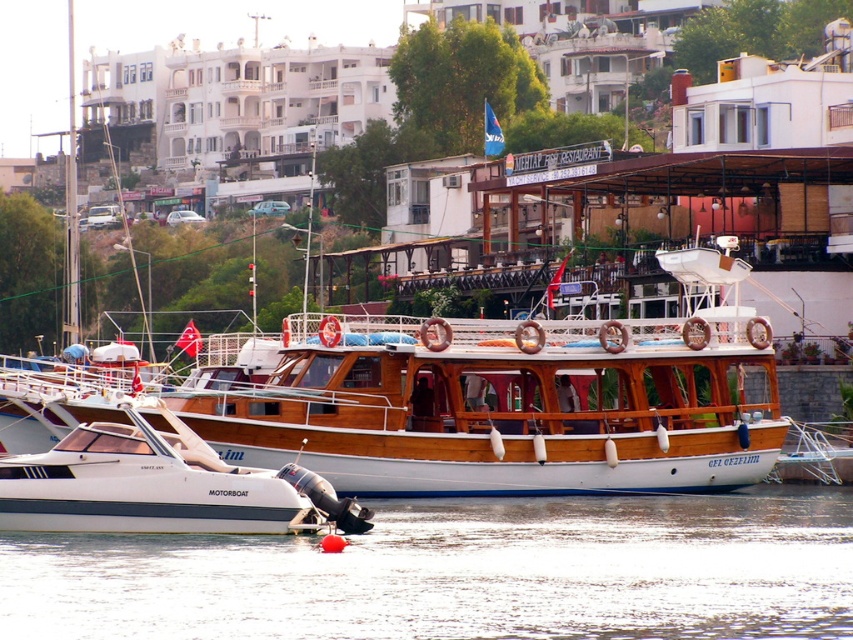
You are standing at the marina and want to reach a specific point marked at coordinates point [585,528]. If your maximum comfortable walking distance is 50 meters, can you comfortably walk to that point from your current position?

The distance of point [585,528] from viewer is 81.42 meters, which exceeds your maximum comfortable walking distance of 50 meters. Therefore, you cannot comfortably walk to that point from your current position.

You are a photographer standing at the edge of the marina, wanting to capture both the white smooth water at lower center and the white glossy motorboat at lower left in a single shot. Based on their positions, which object is closer to your left side?

The white glossy motorboat at lower left is closer to your left side because it is positioned to the left of the white smooth water at lower center.

You are a sailor planning to anchor your boat in the white smooth water at lower center. However, there is a white glossy motorboat at lower left nearby. Based on their positions, will the motorboat block your view of the water surface where you want to anchor?

The white smooth water at lower center is below the white glossy motorboat at lower left, so the motorboat is positioned above the water area you want to anchor. This means the motorboat might block your view of the water surface where you plan to anchor.